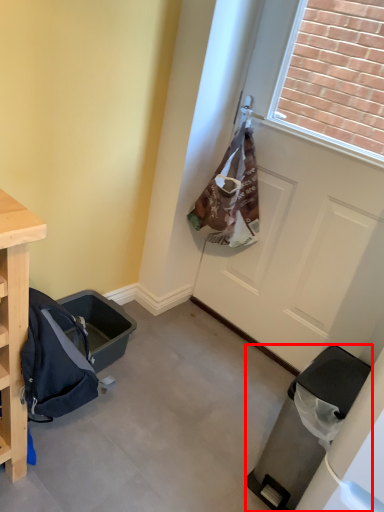
Question: From the image's perspective, what is the correct spatial positioning of trash bin/can (annotated by the red box) in reference to door?

Choices:
 (A) below
 (B) above

Answer: (A)